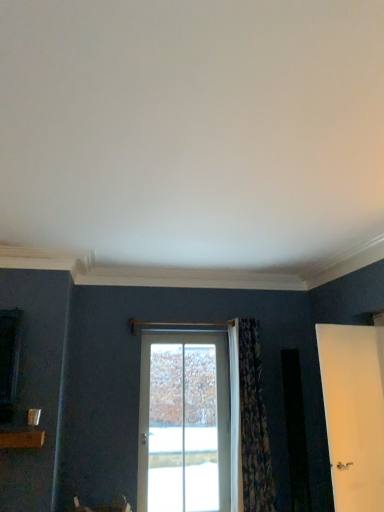
Question: Looking at their shapes, would you say white matte door at right, which is the 1th door from front to back, is wider or thinner than patterned fabric curtain at center?

Choices:
 (A) wide
 (B) thin

Answer: (B)

Question: From a real-world perspective, is white matte door at right, arranged as the 2th door when viewed from the back, above or below patterned fabric curtain at center?

Choices:
 (A) below
 (B) above

Answer: (B)

Question: Which object is the closest to the white glass door at center, which is the first door in back-to-front order?

Choices:
 (A) patterned fabric curtain at center
 (B) white matte door at right, arranged as the 2th door when viewed from the back

Answer: (A)

Question: Which object is the closest to the white matte door at right, which is the second door from left to right?

Choices:
 (A) patterned fabric curtain at center
 (B) white glass door at center, acting as the first door starting from the left

Answer: (A)